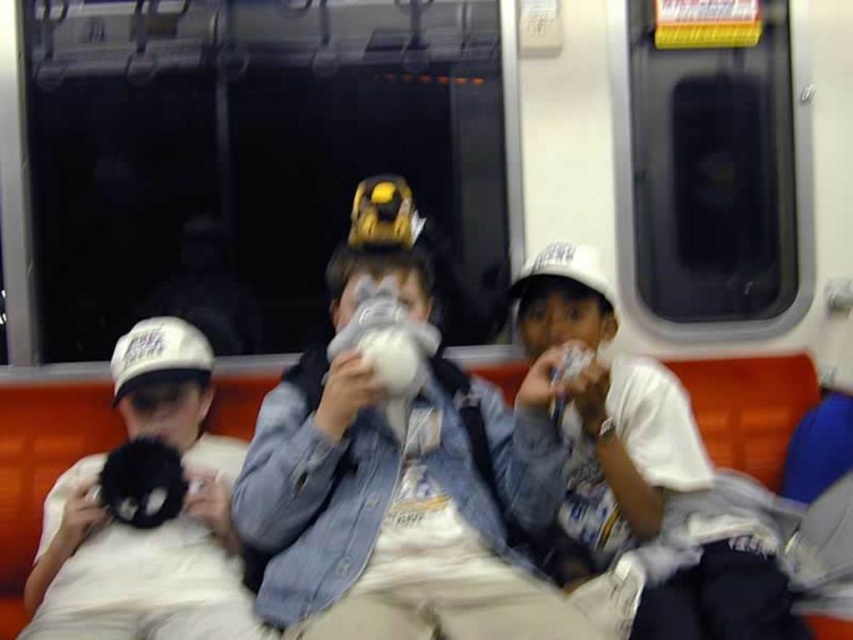
Question: Which point is closer to the camera taking this photo?

Choices:
 (A) (384, 260)
 (B) (144, 577)
 (C) (595, 592)

Answer: (C)

Question: Can you confirm if denim jacket at center is wider than white cotton shirt at right?

Choices:
 (A) no
 (B) yes

Answer: (B)

Question: Which point appears closest to the camera in this image?

Choices:
 (A) (572, 275)
 (B) (267, 486)

Answer: (B)

Question: Which object is closer to the camera taking this photo?

Choices:
 (A) denim jacket at center
 (B) white cotton shirt at right

Answer: (A)

Question: Where is denim jacket at center located in relation to black plush toy at left in the image?

Choices:
 (A) left
 (B) right

Answer: (B)

Question: Is white cotton shirt at right further to camera compared to black plush toy at left?

Choices:
 (A) no
 (B) yes

Answer: (A)